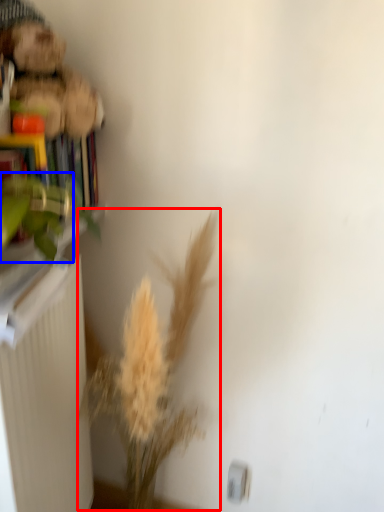
Question: Which object is closer to the camera taking this photo, floral arrangement (highlighted by a red box) or plant (highlighted by a blue box)?

Choices:
 (A) floral arrangement
 (B) plant

Answer: (A)